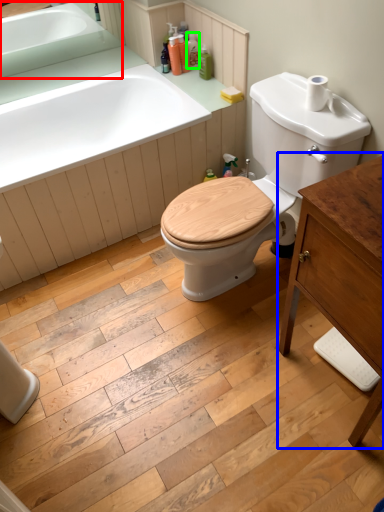
Question: Which object is the closest to the sink (highlighted by a red box)? Choose among these: dresser (highlighted by a blue box) or toiletry (highlighted by a green box).

Choices:
 (A) dresser
 (B) toiletry

Answer: (B)